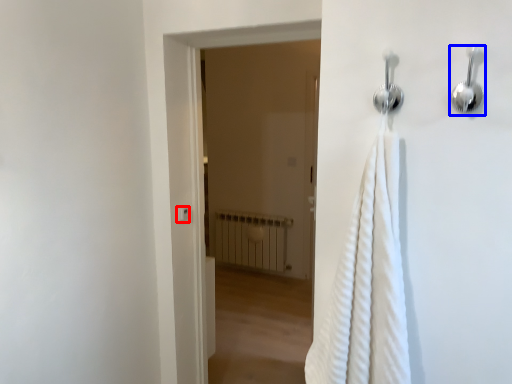
Question: Among these objects, which one is nearest to the camera, light switch (highlighted by a red box) or shower (highlighted by a blue box)?

Choices:
 (A) light switch
 (B) shower

Answer: (B)